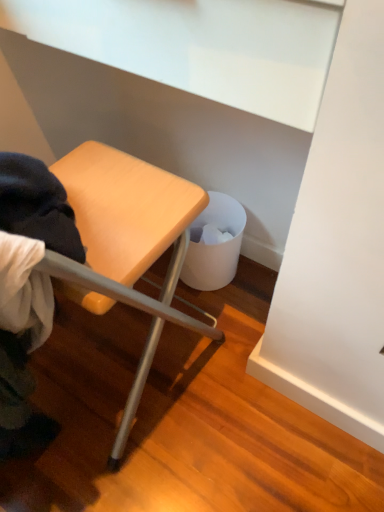
In order to face wooden desk at center, should I rotate leftwards or rightwards?

It's best to rotate left around 13.617 degrees.

This screenshot has width=384, height=512. What do you see at coordinates (120, 244) in the screenshot?
I see `wooden desk at center` at bounding box center [120, 244].

This screenshot has height=512, width=384. Identify the location of wooden desk at center. (120, 244).

This screenshot has height=512, width=384. I want to click on wooden desk at center, so click(x=120, y=244).